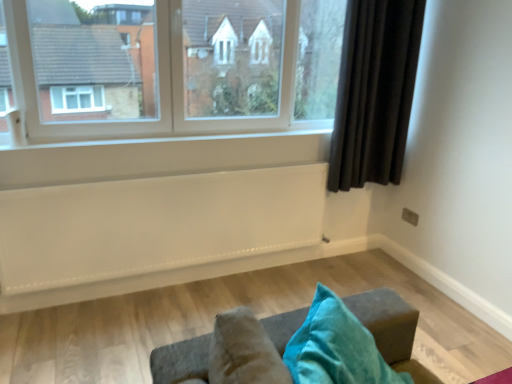
Question: Is dark fabric curtain at right to the left or to the right of white textured radiator at lower center in the image?

Choices:
 (A) left
 (B) right

Answer: (B)

Question: Is dark fabric curtain at right spatially inside white textured radiator at lower center, or outside of it?

Choices:
 (A) inside
 (B) outside

Answer: (B)

Question: Which of these objects is positioned closest to the dark fabric curtain at right?

Choices:
 (A) white painted wood at center
 (B) clear glass window at upper center
 (C) white textured radiator at lower center

Answer: (A)

Question: Which of these objects is positioned farthest from the clear glass window at upper center?

Choices:
 (A) white textured radiator at lower center
 (B) dark fabric curtain at right
 (C) white painted wood at center

Answer: (B)